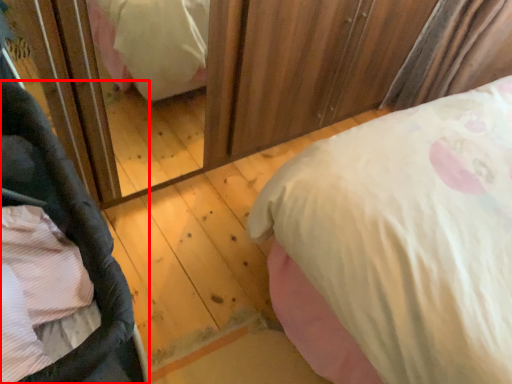
Question: Observing the image, what is the correct spatial positioning of baby carriage (annotated by the red box) in reference to bed?

Choices:
 (A) right
 (B) left

Answer: (B)